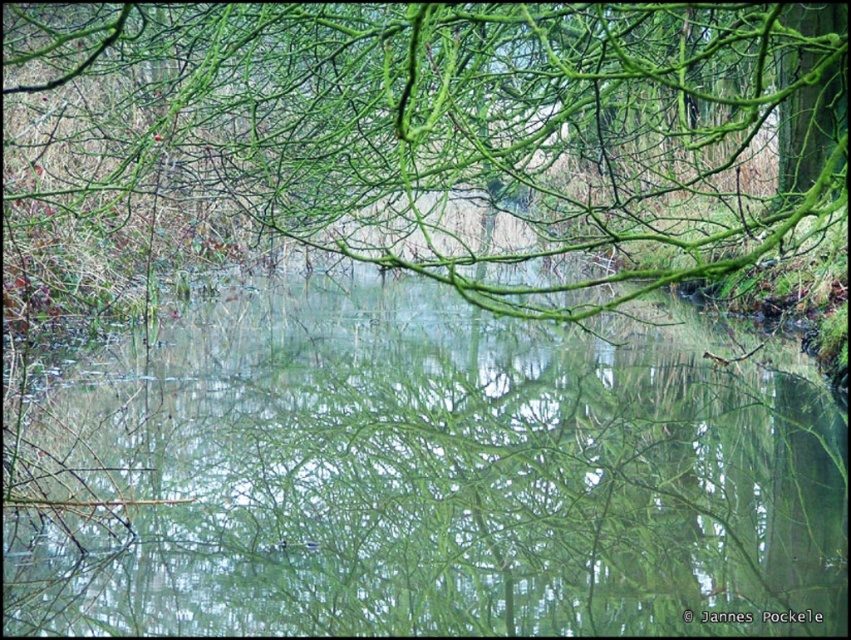
Question: Which point is closer to the camera?

Choices:
 (A) (743, 244)
 (B) (155, 403)

Answer: (A)

Question: In this image, where is green reflective water at center located relative to green matte branches at upper center?

Choices:
 (A) left
 (B) right

Answer: (A)

Question: Can you confirm if green reflective water at center is smaller than green matte branches at upper center?

Choices:
 (A) yes
 (B) no

Answer: (A)

Question: Observing the image, what is the correct spatial positioning of green reflective water at center in reference to green matte branches at upper center?

Choices:
 (A) right
 (B) left

Answer: (B)